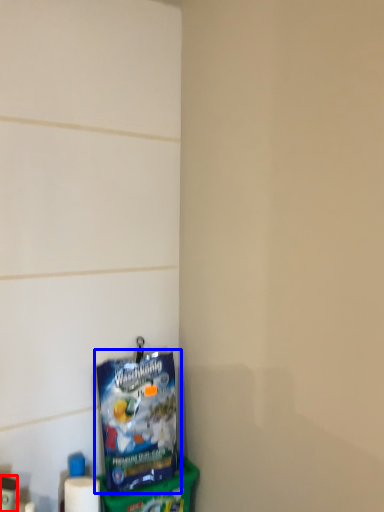
Question: Among these objects, which one is nearest to the camera, toiletry (highlighted by a red box) or toy (highlighted by a blue box)?

Choices:
 (A) toiletry
 (B) toy

Answer: (A)